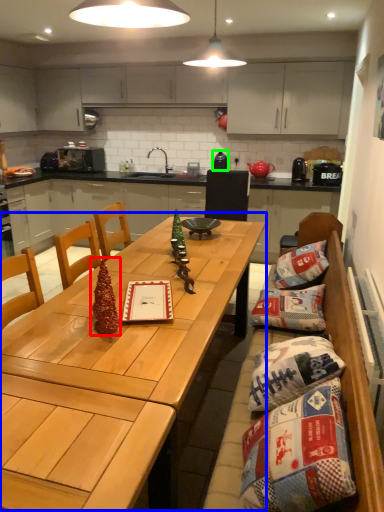
Question: Estimate the real-world distances between objects in this image. Which object is closer to christmas tree (highlighted by a red box), table (highlighted by a blue box) or appliance (highlighted by a green box)?

Choices:
 (A) table
 (B) appliance

Answer: (A)